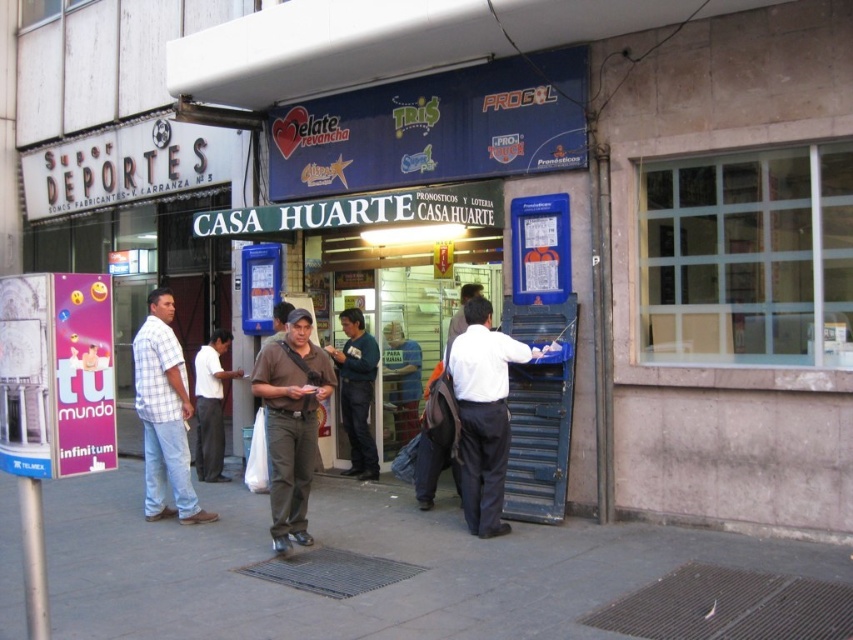
Question: Which point appears closest to the camera in this image?

Choices:
 (A) (367, 464)
 (B) (148, 305)

Answer: (A)

Question: Estimate the real-world distances between objects in this image. Which object is closer to the blue fabric shirt at center?

Choices:
 (A) light blue jeans at left
 (B) dark blue sweater at center

Answer: (B)

Question: Based on their relative distances, which object is nearer to the gray concrete sidewalk at lower center?

Choices:
 (A) matte brown shirt at center
 (B) light blue jeans at left
 (C) white smooth shirt at center
 (D) dark blue sweater at center

Answer: (B)

Question: Does gray concrete sidewalk at lower center appear under blue fabric shirt at center?

Choices:
 (A) yes
 (B) no

Answer: (A)

Question: Considering the relative positions of gray concrete sidewalk at lower center and matte brown shirt at center in the image provided, where is gray concrete sidewalk at lower center located with respect to matte brown shirt at center?

Choices:
 (A) above
 (B) below

Answer: (B)

Question: Does gray concrete sidewalk at lower center appear under blue fabric shirt at center?

Choices:
 (A) no
 (B) yes

Answer: (B)